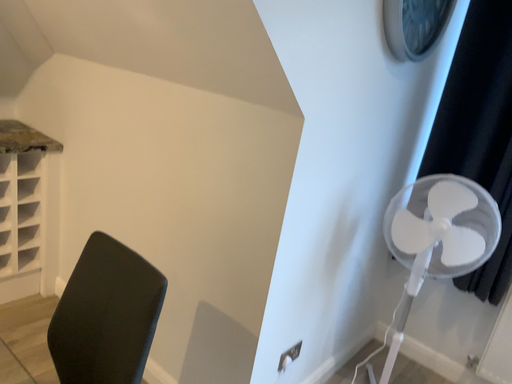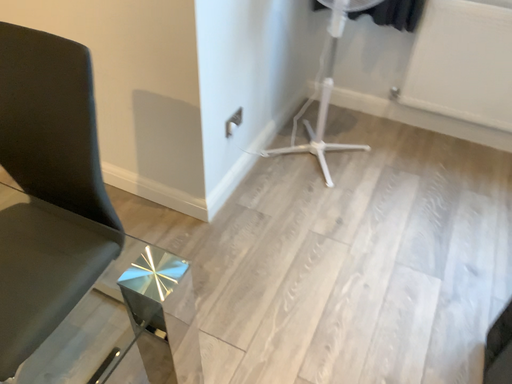
Question: Which way did the camera rotate in the video?

Choices:
 (A) rotated upward
 (B) rotated downward

Answer: (B)